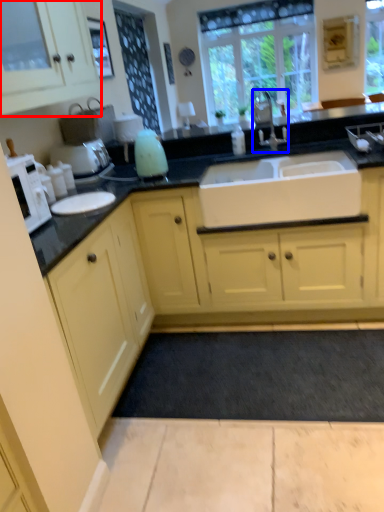
Question: Which object appears closest to the camera in this image, cabinetry (highlighted by a red box) or tap (highlighted by a blue box)?

Choices:
 (A) cabinetry
 (B) tap

Answer: (A)